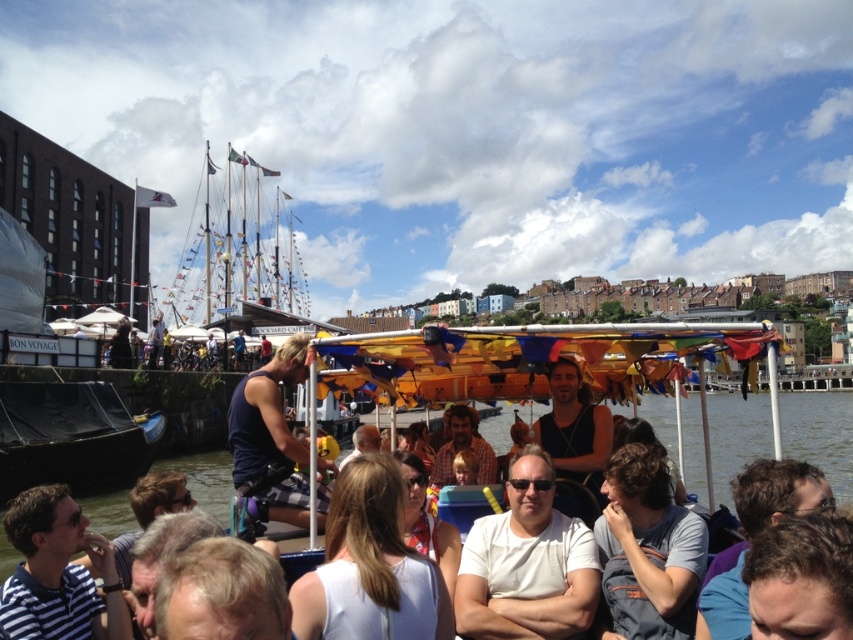
You are a photographer on the dock and want to capture both the striped fabric shirt at lower left and dark brown hair at lower right in a single frame. Since your camera has a fixed focal length, you need to adjust your position to ensure both are fully visible. Which direction should you move to include both subjects without zooming in?

You should move towards the striped fabric shirt at lower left because it is wider than the dark brown hair at lower right, allowing you to position yourself closer to accommodate its larger size while still framing the narrower dark brown hair at lower right.

You are standing on the deck of the boat and want to reach both the point at coordinates point (71, 545) and the point at coordinates point (425, 525). Which point should you reach first to minimize the distance walked?

You should reach the point at coordinates point (71, 545) first because it is closer to you than the point at coordinates point (425, 525).